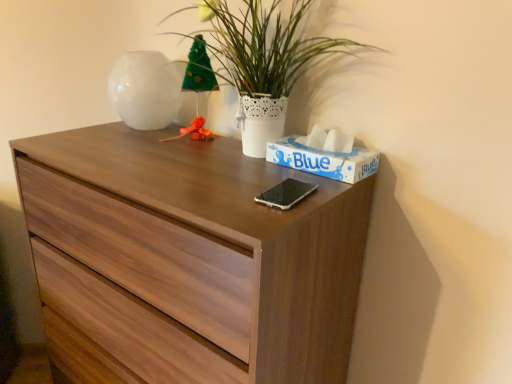
Find the location of a particular element. blue cardboard tissue box at upper right is located at coordinates (323, 160).

This screenshot has height=384, width=512. Describe the element at coordinates (266, 61) in the screenshot. I see `green leafy plant at upper center` at that location.

Describe the element at coordinates (145, 90) in the screenshot. This screenshot has height=384, width=512. I see `white glossy vase at upper left` at that location.

You are a GUI agent. You are given a task and a screenshot of the screen. Output one action in this format:
    pyautogui.click(x=<x>, y=<y>)
    Task: Click on the blue cardboard tissue box at upper right
    The image size is (512, 384).
    Given the screenshot: What is the action you would take?
    pyautogui.click(x=323, y=160)

In the image, is green leafy plant at upper center on the left side or the right side of wooden chest of drawers at center?

green leafy plant at upper center is positioned on wooden chest of drawers at center's right side.

Is green leafy plant at upper center shorter than wooden chest of drawers at center?

Correct, green leafy plant at upper center is not as tall as wooden chest of drawers at center.

From the picture: Which is closer to the camera, (284, 79) or (262, 231)?

Clearly, point (284, 79) is more distant from the camera than point (262, 231).

Does green leafy plant at upper center have a smaller size compared to wooden chest of drawers at center?

Yes, green leafy plant at upper center is smaller than wooden chest of drawers at center.

Is wooden chest of drawers at center beside green leafy plant at upper center?

No, wooden chest of drawers at center is not with green leafy plant at upper center.

Is wooden chest of drawers at center oriented away from green leafy plant at upper center?

wooden chest of drawers at center is not turned away from green leafy plant at upper center.

Is point (278, 338) positioned in front of point (244, 61)?

Yes, it is in front of point (244, 61).

From the picture: Considering their positions, is green leafy plant at upper center located in front of or behind white glossy vase at upper left?

green leafy plant at upper center is in front of white glossy vase at upper left.

You are a GUI agent. You are given a task and a screenshot of the screen. Output one action in this format:
    pyautogui.click(x=<x>, y=<y>)
    Task: Click on the vase behind the green leafy plant at upper center
    The image size is (512, 384).
    Given the screenshot: What is the action you would take?
    pyautogui.click(x=145, y=90)

From the picture: Considering the sizes of objects green leafy plant at upper center and white glossy vase at upper left in the image provided, who is shorter, green leafy plant at upper center or white glossy vase at upper left?

white glossy vase at upper left.

Is green leafy plant at upper center looking in the opposite direction of white glossy vase at upper left?

No.

From a real-world perspective, is white glossy vase at upper left physically located above or below green leafy plant at upper center?

Clearly, from a real-world perspective, white glossy vase at upper left is below green leafy plant at upper center.

What are the coordinates of `vase below the green leafy plant at upper center (from a real-world perspective)` in the screenshot? It's located at (145, 90).

Is white glossy vase at upper left in front of or behind green leafy plant at upper center in the image?

white glossy vase at upper left is positioned farther from the viewer than green leafy plant at upper center.

Is white glossy vase at upper left aimed at green leafy plant at upper center?

No, white glossy vase at upper left is not facing towards green leafy plant at upper center.

From a real-world perspective, between white glossy vase at upper left and blue cardboard tissue box at upper right, who is vertically higher?

In real-world perspective, white glossy vase at upper left is above.

Is white glossy vase at upper left positioned beyond the bounds of blue cardboard tissue box at upper right?

Yes, white glossy vase at upper left is located beyond the bounds of blue cardboard tissue box at upper right.

In the image, there is a white glossy vase at upper left. At what (x,y) coordinates should I click in order to perform the action: click on box below it (from the image's perspective). Please return your answer as a coordinate pair (x, y). The height and width of the screenshot is (384, 512). Looking at the image, I should click on (323, 160).

Could you tell me if white glossy vase at upper left is facing blue cardboard tissue box at upper right?

No, white glossy vase at upper left is not aimed at blue cardboard tissue box at upper right.

Is blue cardboard tissue box at upper right aimed at white glossy vase at upper left?

No, blue cardboard tissue box at upper right is not turned towards white glossy vase at upper left.

Is point (291, 152) positioned behind point (146, 125)?

No, (291, 152) is in front of (146, 125).

Considering the sizes of objects blue cardboard tissue box at upper right and white glossy vase at upper left in the image provided, who is taller, blue cardboard tissue box at upper right or white glossy vase at upper left?

white glossy vase at upper left.

Is blue cardboard tissue box at upper right not inside white glossy vase at upper left?

Yes, blue cardboard tissue box at upper right is not within white glossy vase at upper left.

Can you confirm if wooden chest of drawers at center is bigger than white glossy vase at upper left?

Correct, wooden chest of drawers at center is larger in size than white glossy vase at upper left.

Are wooden chest of drawers at center and white glossy vase at upper left located far from each other?

Actually, wooden chest of drawers at center and white glossy vase at upper left are a little close together.

From a real-world perspective, between wooden chest of drawers at center and white glossy vase at upper left, who is vertically lower?

From a 3D spatial view, wooden chest of drawers at center is below.

The image size is (512, 384). Find the location of `the chest of drawers lying below the green leafy plant at upper center (from the image's perspective)`. the chest of drawers lying below the green leafy plant at upper center (from the image's perspective) is located at coordinates pos(189,259).

Where is `houseplant lying behind the wooden chest of drawers at center`? houseplant lying behind the wooden chest of drawers at center is located at coordinates (266, 61).

Consider the image. Looking at the image, which one is located closer to green leafy plant at upper center, white glossy vase at upper left or wooden chest of drawers at center?

The object closer to green leafy plant at upper center is white glossy vase at upper left.

Looking at the image, which one is located closer to wooden chest of drawers at center, blue cardboard tissue box at upper right or white glossy vase at upper left?

blue cardboard tissue box at upper right lies closer to wooden chest of drawers at center than the other object.

From the image, which object appears to be nearer to green leafy plant at upper center, blue cardboard tissue box at upper right or white glossy vase at upper left?

blue cardboard tissue box at upper right.

Based on their spatial positions, is wooden chest of drawers at center or green leafy plant at upper center further from blue cardboard tissue box at upper right?

Among the two, wooden chest of drawers at center is located further to blue cardboard tissue box at upper right.

From the image, which object appears to be nearer to white glossy vase at upper left, wooden chest of drawers at center or blue cardboard tissue box at upper right?

wooden chest of drawers at center is closer to white glossy vase at upper left.

Based on their spatial positions, is green leafy plant at upper center or wooden chest of drawers at center closer to blue cardboard tissue box at upper right?

Answer: Based on the image, green leafy plant at upper center appears to be nearer to blue cardboard tissue box at upper right.

From the image, which object appears to be nearer to blue cardboard tissue box at upper right, green leafy plant at upper center or white glossy vase at upper left?

green leafy plant at upper center lies closer to blue cardboard tissue box at upper right than the other object.

From the image, which object appears to be nearer to blue cardboard tissue box at upper right, white glossy vase at upper left or green leafy plant at upper center?

green leafy plant at upper center lies closer to blue cardboard tissue box at upper right than the other object.

Locate an element on the screen. This screenshot has width=512, height=384. houseplant between white glossy vase at upper left and blue cardboard tissue box at upper right from left to right is located at coordinates tap(266, 61).

Where is `houseplant between white glossy vase at upper left and wooden chest of drawers at center in the vertical direction`? This screenshot has height=384, width=512. houseplant between white glossy vase at upper left and wooden chest of drawers at center in the vertical direction is located at coordinates (266, 61).

Find the location of `box between green leafy plant at upper center and wooden chest of drawers at center vertically`. box between green leafy plant at upper center and wooden chest of drawers at center vertically is located at coordinates (x=323, y=160).

Image resolution: width=512 pixels, height=384 pixels. In order to click on box between white glossy vase at upper left and wooden chest of drawers at center from top to bottom in this screenshot , I will do `click(323, 160)`.